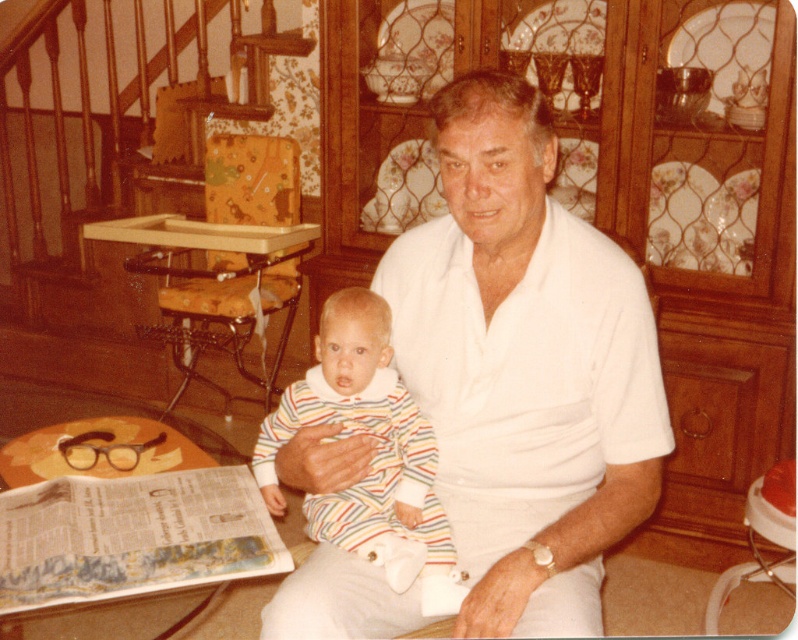
Question: Is white cotton shirt at center to the left of striped fabric onesie at center from the viewer's perspective?

Choices:
 (A) no
 (B) yes

Answer: (A)

Question: Can you confirm if white cotton shirt at center is wider than striped fabric onesie at center?

Choices:
 (A) no
 (B) yes

Answer: (B)

Question: Which point appears closest to the camera in this image?

Choices:
 (A) (269, 449)
 (B) (460, 163)

Answer: (B)

Question: Does white cotton shirt at center have a smaller size compared to striped fabric onesie at center?

Choices:
 (A) yes
 (B) no

Answer: (B)